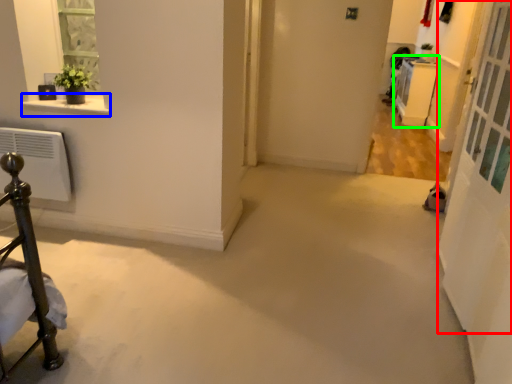
Question: Which is farther away from screen door (highlighted by a red box)? window sill (highlighted by a blue box) or furniture (highlighted by a green box)?

Choices:
 (A) window sill
 (B) furniture

Answer: (B)